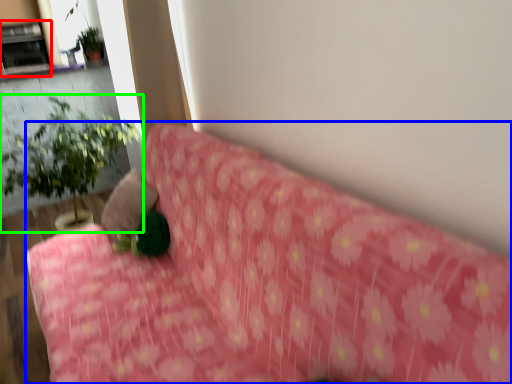
Question: Which object is the farthest from fireplace (highlighted by a red box)? Choose among these: furniture (highlighted by a blue box) or houseplant (highlighted by a green box).

Choices:
 (A) furniture
 (B) houseplant

Answer: (A)